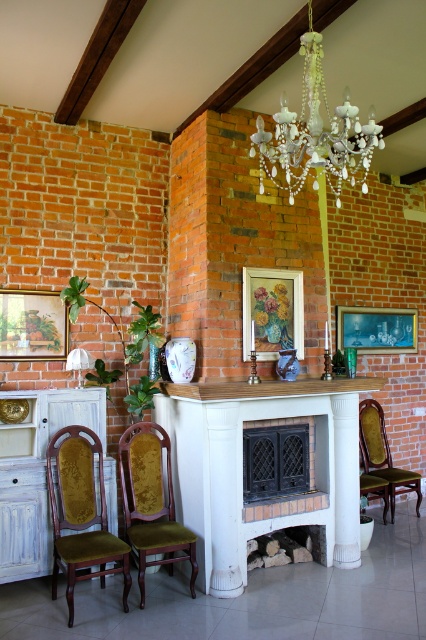
Question: Which of the following is the closest to the observer?

Choices:
 (A) wooden mantel at center
 (B) crystal glass chandelier at upper center
 (C) velvet green chair at center

Answer: (B)

Question: Which is farther from the velvet gold chair at right?

Choices:
 (A) white wood fireplace at center
 (B) velvet/golden-brown chair at left

Answer: (B)

Question: Does white wood fireplace at center have a smaller size compared to velvet gold chair at right?

Choices:
 (A) no
 (B) yes

Answer: (A)

Question: Among these points, which one is nearest to the camera?

Choices:
 (A) (193, 387)
 (B) (52, 508)
 (C) (161, 460)

Answer: (B)

Question: Does velvet/golden-brown chair at left have a larger size compared to wooden picture frame at left?

Choices:
 (A) no
 (B) yes

Answer: (B)

Question: Does wooden mantel at center appear under wooden picture frame at center?

Choices:
 (A) yes
 (B) no

Answer: (A)